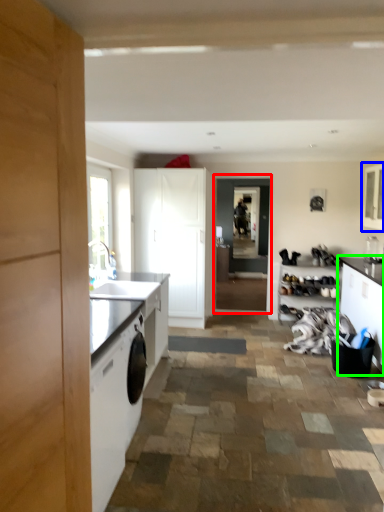
Question: Estimate the real-world distances between objects in this image. Which object is farther from screen door (highlighted by a red box), cabinetry (highlighted by a blue box) or cabinetry (highlighted by a green box)?

Choices:
 (A) cabinetry
 (B) cabinetry

Answer: (B)